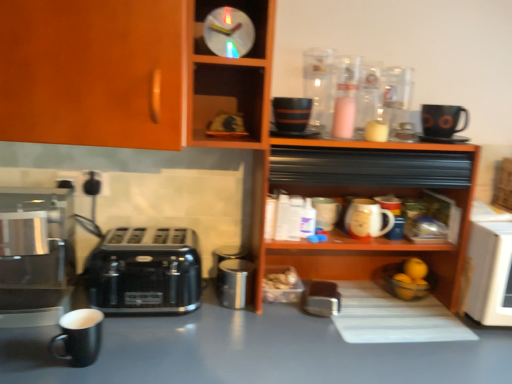
Where is `free space that is in between black matte mug at lower left and metallic silver canister at center`? free space that is in between black matte mug at lower left and metallic silver canister at center is located at coordinates (167, 327).